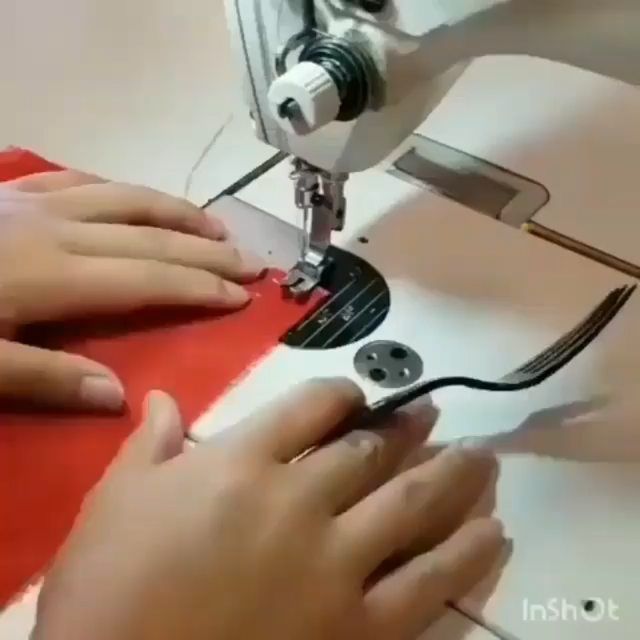
Locate an element on the screen. This screenshot has width=640, height=640. fabric / cloth - red is located at coordinates (203, 358).